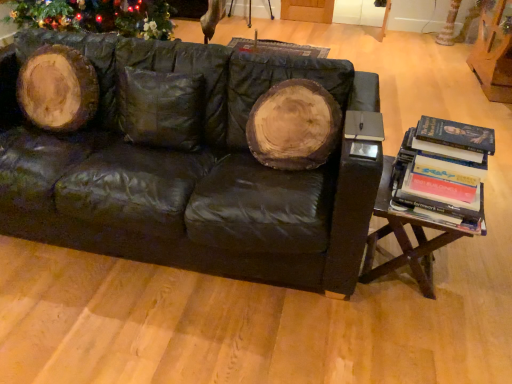
This screenshot has width=512, height=384. What do you see at coordinates (444, 171) in the screenshot?
I see `hardcover books at right` at bounding box center [444, 171].

Find the location of a particular element. Image resolution: width=512 pixels, height=384 pixels. woodenmaterial/texturetable at right is located at coordinates (406, 235).

What do you see at coordinates (191, 167) in the screenshot? This screenshot has height=384, width=512. I see `black leather couch at center` at bounding box center [191, 167].

Image resolution: width=512 pixels, height=384 pixels. I want to click on white textured tree trunk at upper right, so click(449, 25).

Locate an element on the screen. This screenshot has width=512, height=384. hardcover books at right is located at coordinates (444, 171).

From the picture: From a real-world perspective, is black leather couch at center positioned under woodenmaterial/texturetable at right based on gravity?

No, from a real-world perspective, black leather couch at center is not under woodenmaterial/texturetable at right.

From the image's perspective, which object appears higher, black leather couch at center or woodenmaterial/texturetable at right?

black leather couch at center is shown above in the image.

Considering the positions of objects black leather couch at center and woodenmaterial/texturetable at right in the image provided, who is more to the right, black leather couch at center or woodenmaterial/texturetable at right?

woodenmaterial/texturetable at right is more to the right.

Based on the photo, how different are the orientations of black leather couch at center and woodenmaterial/texturetable at right in degrees?

black leather couch at center and woodenmaterial/texturetable at right are facing 6.09 degrees away from each other.

Looking at this image, which object is further away from the camera, black leather couch at center or hardcover books at right?

Positioned behind is hardcover books at right.

Is black leather couch at center shorter than hardcover books at right?

No, black leather couch at center is not shorter than hardcover books at right.

From a real-world perspective, is black leather couch at center below hardcover books at right?

Yes.

Does black leather couch at center have a larger size compared to hardcover books at right?

Yes.

Can you confirm if woodenmaterial/texturetable at right is smaller than black leather couch at center?

Yes, woodenmaterial/texturetable at right is smaller than black leather couch at center.

Can you confirm if woodenmaterial/texturetable at right is positioned to the left of black leather couch at center?

In fact, woodenmaterial/texturetable at right is to the right of black leather couch at center.

Does point (451, 237) come closer to viewer compared to point (81, 36)?

Yes, it is.

How different are the orientations of woodenmaterial/texturetable at right and black leather couch at center in degrees?

There is a 6.09-degree angle between the facing directions of woodenmaterial/texturetable at right and black leather couch at center.

From the image's perspective, which one is positioned lower, woodenmaterial/texturetable at right or matte black book at right?

woodenmaterial/texturetable at right appears lower in the image.

Is woodenmaterial/texturetable at right far from matte black book at right?

Actually, woodenmaterial/texturetable at right and matte black book at right are a little close together.

From a real-world perspective, is woodenmaterial/texturetable at right positioned over matte black book at right based on gravity?

No, from a real-world perspective, woodenmaterial/texturetable at right is not above matte black book at right.

Looking at their sizes, would you say white textured tree trunk at upper right is wider or thinner than hardcover books at right?

In the image, white textured tree trunk at upper right appears to be wider than hardcover books at right.

Considering the relative sizes of white textured tree trunk at upper right and hardcover books at right in the image provided, is white textured tree trunk at upper right smaller than hardcover books at right?

Incorrect, white textured tree trunk at upper right is not smaller in size than hardcover books at right.

From the image's perspective, is white textured tree trunk at upper right above hardcover books at right?

Yes.

Can you confirm if white textured tree trunk at upper right is shorter than hardcover books at right?

Incorrect, the height of white textured tree trunk at upper right does not fall short of that of hardcover books at right.

Can you confirm if hardcover books at right is positioned to the right of black leather couch at center?

Indeed, hardcover books at right is positioned on the right side of black leather couch at center.

Are hardcover books at right and black leather couch at center located far from each other?

No, hardcover books at right is not far from black leather couch at center.

Based on the photo, is black leather couch at center a part of hardcover books at right?

No, black leather couch at center is not inside hardcover books at right.

Considering the sizes of objects hardcover books at right and black leather couch at center in the image provided, who is taller, hardcover books at right or black leather couch at center?

Standing taller between the two is black leather couch at center.

Would you consider matte black book at right to be distant from black leather couch at center?

matte black book at right is near black leather couch at center, not far away.

The image size is (512, 384). Find the location of `paperback book that is on the right side of black leather couch at center`. paperback book that is on the right side of black leather couch at center is located at coordinates (364, 126).

From a real-world perspective, relative to black leather couch at center, is matte black book at right vertically above or below?

From a real-world perspective, matte black book at right is physically above black leather couch at center.

Between point (376, 135) and point (164, 104), which one is positioned in front?

The point (376, 135) is closer.

The height and width of the screenshot is (384, 512). What are the coordinates of `table below the black leather couch at center (from the image's perspective)` in the screenshot? It's located at (406, 235).

Where is `book positioned vertically above the black leather couch at center (from a real-world perspective)`? This screenshot has height=384, width=512. book positioned vertically above the black leather couch at center (from a real-world perspective) is located at coordinates (444, 171).

From the image, which object appears to be farther from white textured tree trunk at upper right, woodenmaterial/texturetable at right or hardcover books at right?

hardcover books at right is positioned further to the anchor white textured tree trunk at upper right.

Considering their positions, is woodenmaterial/texturetable at right positioned further to white textured tree trunk at upper right than black leather couch at center?

black leather couch at center is further to white textured tree trunk at upper right.

Estimate the real-world distances between objects in this image. Which object is closer to white textured tree trunk at upper right, black leather couch at center or hardcover books at right?

Based on the image, hardcover books at right appears to be nearer to white textured tree trunk at upper right.

Considering their positions, is white textured tree trunk at upper right positioned further to hardcover books at right than matte black book at right?

white textured tree trunk at upper right.

Which object lies further to the anchor point black leather couch at center, matte black book at right or white textured tree trunk at upper right?

white textured tree trunk at upper right lies further to black leather couch at center than the other object.

Considering their positions, is matte black book at right positioned closer to hardcover books at right than white textured tree trunk at upper right?

matte black book at right is closer to hardcover books at right.

Looking at the image, which one is located further to white textured tree trunk at upper right, woodenmaterial/texturetable at right or matte black book at right?

woodenmaterial/texturetable at right lies further to white textured tree trunk at upper right than the other object.

Looking at the image, which one is located further to white textured tree trunk at upper right, black leather couch at center or matte black book at right?

black leather couch at center lies further to white textured tree trunk at upper right than the other object.

What are the coordinates of `paperback book located between black leather couch at center and hardcover books at right in the left-right direction` in the screenshot? It's located at (364, 126).

Where is `paperback book located between woodenmaterial/texturetable at right and white textured tree trunk at upper right in the depth direction`? paperback book located between woodenmaterial/texturetable at right and white textured tree trunk at upper right in the depth direction is located at coordinates 364,126.

Identify the location of book between matte black book at right and woodenmaterial/texturetable at right in the vertical direction. coord(444,171).

This screenshot has width=512, height=384. I want to click on book situated between black leather couch at center and woodenmaterial/texturetable at right from left to right, so click(444, 171).